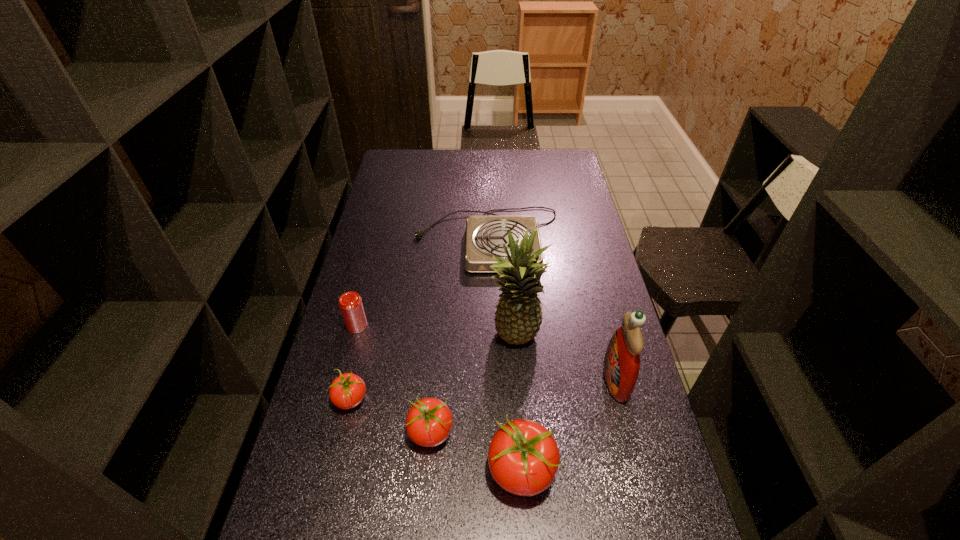
Please point a vacant point for placing a tomato on the right. Please provide its 2D coordinates. Your answer should be formatted as a tuple, i.e. [(x, y)], where the tuple contains the x and y coordinates of a point satisfying the conditions above.

[(626, 517)]